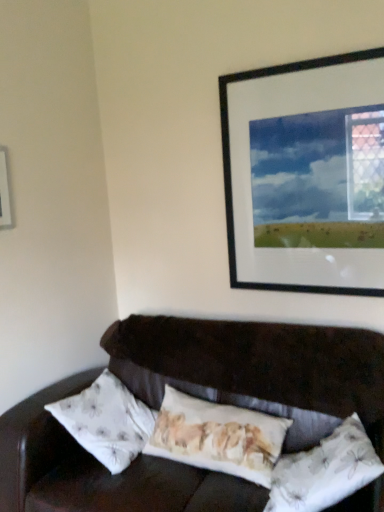
Locate an element on the screen. This screenshot has width=384, height=512. white plastic picture frame at upper left, the 1th picture frame from the left is located at coordinates (4, 192).

How much space does white floral fabric pillow at lower right, the 2th pillow when ordered from left to right, occupy horizontally?

white floral fabric pillow at lower right, the 2th pillow when ordered from left to right, is 18.55 inches in width.

Locate an element on the screen. This screenshot has width=384, height=512. black matte picture frame at upper right, which ranks as the second picture frame in left-to-right order is located at coordinates (306, 175).

Describe the element at coordinates (217, 437) in the screenshot. I see `floral fabric pillow at center, which is counted as the 1th pillow, starting from the left` at that location.

Locate an element on the screen. The width and height of the screenshot is (384, 512). white plastic picture frame at upper left, the 1th picture frame from the left is located at coordinates (4, 192).

Is white floral fabric pillow at lower right, which is the 1th pillow in right-to-left order, taller than white plastic picture frame at upper left, the 1th picture frame from the left?

Yes, white floral fabric pillow at lower right, which is the 1th pillow in right-to-left order, is taller than white plastic picture frame at upper left, the 1th picture frame from the left.

Would you say white floral fabric pillow at lower right, which is the 1th pillow in right-to-left order, is outside white plastic picture frame at upper left, the 1th picture frame from the left?

Absolutely, white floral fabric pillow at lower right, which is the 1th pillow in right-to-left order, is external to white plastic picture frame at upper left, the 1th picture frame from the left.

Between white floral fabric pillow at lower right, the 2th pillow when ordered from left to right, and white plastic picture frame at upper left, placed as the second picture frame when sorted from right to left, which one appears on the left side from the viewer's perspective?

white plastic picture frame at upper left, placed as the second picture frame when sorted from right to left.

From a real-world perspective, which is physically below, white floral fabric pillow at lower right, the 2th pillow when ordered from left to right, or white plastic picture frame at upper left, placed as the second picture frame when sorted from right to left?

In real-world perspective, white floral fabric pillow at lower right, the 2th pillow when ordered from left to right, is lower.

Which of these two, white floral fabric pillow at lower right, the 2th pillow when ordered from left to right, or floral fabric pillow at center, which is counted as the 1th pillow, starting from the left, stands shorter?

With less height is white floral fabric pillow at lower right, the 2th pillow when ordered from left to right.

At what (x,y) coordinates should I click in order to perform the action: click on pillow behind the white floral fabric pillow at lower right, the 2th pillow when ordered from left to right. Please return your answer as a coordinate pair (x, y). This screenshot has width=384, height=512. Looking at the image, I should click on (217, 437).

From the image's perspective, relative to floral fabric pillow at center, which is counted as the 1th pillow, starting from the left, is white floral fabric pillow at lower right, which is the 1th pillow in right-to-left order, above or below?

white floral fabric pillow at lower right, which is the 1th pillow in right-to-left order, is below floral fabric pillow at center, which is counted as the 1th pillow, starting from the left.

Considering the relative sizes of white floral fabric pillow at lower right, which is the 1th pillow in right-to-left order, and floral fabric pillow at center, which is counted as the 1th pillow, starting from the left, in the image provided, is white floral fabric pillow at lower right, which is the 1th pillow in right-to-left order, thinner than floral fabric pillow at center, which is counted as the 1th pillow, starting from the left,?

No, white floral fabric pillow at lower right, which is the 1th pillow in right-to-left order, is not thinner than floral fabric pillow at center, which is counted as the 1th pillow, starting from the left.

Is white floral fabric pillow at lower right, which is the 1th pillow in right-to-left order, at the right side of black matte picture frame at upper right, which ranks as the second picture frame in left-to-right order?

Incorrect, white floral fabric pillow at lower right, which is the 1th pillow in right-to-left order, is not on the right side of black matte picture frame at upper right, which ranks as the second picture frame in left-to-right order.

From the picture: What's the angular difference between white floral fabric pillow at lower right, which is the 1th pillow in right-to-left order, and black matte picture frame at upper right, marked as the first picture frame in a right-to-left arrangement,'s facing directions?

78.6 degrees separate the facing orientations of white floral fabric pillow at lower right, which is the 1th pillow in right-to-left order, and black matte picture frame at upper right, marked as the first picture frame in a right-to-left arrangement.

Does white floral fabric pillow at lower right, the 2th pillow when ordered from left to right, turn towards black matte picture frame at upper right, marked as the first picture frame in a right-to-left arrangement?

No, white floral fabric pillow at lower right, the 2th pillow when ordered from left to right, is not aimed at black matte picture frame at upper right, marked as the first picture frame in a right-to-left arrangement.

Starting from the white floral fabric pillow at lower right, the 2th pillow when ordered from left to right, which picture frame is the 2nd one behind? Please provide its 2D coordinates.

[(306, 175)]

From a real-world perspective, is floral fabric pillow at center, which is counted as the 1th pillow, starting from the left, positioned over white plastic picture frame at upper left, the 1th picture frame from the left, based on gravity?

Incorrect, from a real-world perspective, floral fabric pillow at center, which is counted as the 1th pillow, starting from the left, is lower than white plastic picture frame at upper left, the 1th picture frame from the left.

Considering the positions of points (187, 397) and (6, 155), is point (187, 397) closer to camera compared to point (6, 155)?

No, (187, 397) is further to viewer.

This screenshot has height=512, width=384. What are the coordinates of `picture frame on the left of floral fabric pillow at center, positioned as the 2th pillow in right-to-left order` in the screenshot? It's located at (4, 192).

From the image's perspective, which object appears higher, floral fabric pillow at center, positioned as the 2th pillow in right-to-left order, or white plastic picture frame at upper left, the 1th picture frame from the left?

From the image's view, white plastic picture frame at upper left, the 1th picture frame from the left, is above.

In the scene shown: Which is farther from the camera, (314, 113) or (348, 480)?

The point (314, 113) is farther.

Looking at this image, how different are the orientations of black matte picture frame at upper right, which ranks as the second picture frame in left-to-right order, and white floral fabric pillow at lower right, which is the 1th pillow in right-to-left order, in degrees?

They differ by 78.6 degrees in their facing directions.

Choose the correct answer: Is black matte picture frame at upper right, which ranks as the second picture frame in left-to-right order, inside white floral fabric pillow at lower right, the 2th pillow when ordered from left to right, or outside it?

black matte picture frame at upper right, which ranks as the second picture frame in left-to-right order, is outside white floral fabric pillow at lower right, the 2th pillow when ordered from left to right.

Is black matte picture frame at upper right, marked as the first picture frame in a right-to-left arrangement, wider or thinner than white floral fabric pillow at lower right, the 2th pillow when ordered from left to right?

black matte picture frame at upper right, marked as the first picture frame in a right-to-left arrangement, is thinner than white floral fabric pillow at lower right, the 2th pillow when ordered from left to right.

Is white plastic picture frame at upper left, the 1th picture frame from the left, turned away from white floral fabric pillow at lower right, the 2th pillow when ordered from left to right?

white plastic picture frame at upper left, the 1th picture frame from the left, does not have its back to white floral fabric pillow at lower right, the 2th pillow when ordered from left to right.

Between white plastic picture frame at upper left, placed as the second picture frame when sorted from right to left, and white floral fabric pillow at lower right, which is the 1th pillow in right-to-left order, which one has less height?

Standing shorter between the two is white plastic picture frame at upper left, placed as the second picture frame when sorted from right to left.

Starting from the white plastic picture frame at upper left, the 1th picture frame from the left, which pillow is the 2nd one to the right? Please provide its 2D coordinates.

[(325, 471)]

Considering the relative sizes of white plastic picture frame at upper left, the 1th picture frame from the left, and floral fabric pillow at center, which is counted as the 1th pillow, starting from the left, in the image provided, is white plastic picture frame at upper left, the 1th picture frame from the left, shorter than floral fabric pillow at center, which is counted as the 1th pillow, starting from the left,?

Yes, white plastic picture frame at upper left, the 1th picture frame from the left, is shorter than floral fabric pillow at center, which is counted as the 1th pillow, starting from the left.

Could you tell me if white plastic picture frame at upper left, placed as the second picture frame when sorted from right to left, is turned towards floral fabric pillow at center, positioned as the 2th pillow in right-to-left order?

No, white plastic picture frame at upper left, placed as the second picture frame when sorted from right to left, is not facing towards floral fabric pillow at center, positioned as the 2th pillow in right-to-left order.

Is white plastic picture frame at upper left, the 1th picture frame from the left, in front of or behind floral fabric pillow at center, positioned as the 2th pillow in right-to-left order, in the image?

white plastic picture frame at upper left, the 1th picture frame from the left, is positioned farther from the viewer than floral fabric pillow at center, positioned as the 2th pillow in right-to-left order.

Which is in front, point (7, 190) or point (246, 428)?

The point (246, 428) is closer to the camera.

Locate an element on the screen. pillow that is the 2nd object directly below the white plastic picture frame at upper left, placed as the second picture frame when sorted from right to left (from a real-world perspective) is located at coordinates (325, 471).

The height and width of the screenshot is (512, 384). Identify the location of pillow in front of the floral fabric pillow at center, positioned as the 2th pillow in right-to-left order. (325, 471).

Based on their spatial positions, is floral fabric pillow at center, positioned as the 2th pillow in right-to-left order, or black matte picture frame at upper right, which ranks as the second picture frame in left-to-right order, closer to white floral fabric pillow at lower right, which is the 1th pillow in right-to-left order?

Based on the image, floral fabric pillow at center, positioned as the 2th pillow in right-to-left order, appears to be nearer to white floral fabric pillow at lower right, which is the 1th pillow in right-to-left order.

Looking at the image, which one is located further to white floral fabric pillow at lower right, the 2th pillow when ordered from left to right, black matte picture frame at upper right, which ranks as the second picture frame in left-to-right order, or white plastic picture frame at upper left, the 1th picture frame from the left?

Based on the image, white plastic picture frame at upper left, the 1th picture frame from the left, appears to be further to white floral fabric pillow at lower right, the 2th pillow when ordered from left to right.

From the image, which object appears to be nearer to white plastic picture frame at upper left, the 1th picture frame from the left, black matte picture frame at upper right, marked as the first picture frame in a right-to-left arrangement, or floral fabric pillow at center, positioned as the 2th pillow in right-to-left order?

Among the two, floral fabric pillow at center, positioned as the 2th pillow in right-to-left order, is located nearer to white plastic picture frame at upper left, the 1th picture frame from the left.

Which object lies further to the anchor point black matte picture frame at upper right, which ranks as the second picture frame in left-to-right order, floral fabric pillow at center, which is counted as the 1th pillow, starting from the left, or white plastic picture frame at upper left, the 1th picture frame from the left?

Based on the image, white plastic picture frame at upper left, the 1th picture frame from the left, appears to be further to black matte picture frame at upper right, which ranks as the second picture frame in left-to-right order.

When comparing their distances from white plastic picture frame at upper left, placed as the second picture frame when sorted from right to left, does white floral fabric pillow at lower right, which is the 1th pillow in right-to-left order, or black matte picture frame at upper right, marked as the first picture frame in a right-to-left arrangement, seem closer?

black matte picture frame at upper right, marked as the first picture frame in a right-to-left arrangement, is closer to white plastic picture frame at upper left, placed as the second picture frame when sorted from right to left.

Considering their positions, is white floral fabric pillow at lower right, which is the 1th pillow in right-to-left order, positioned further to white plastic picture frame at upper left, placed as the second picture frame when sorted from right to left, than floral fabric pillow at center, which is counted as the 1th pillow, starting from the left?

white floral fabric pillow at lower right, which is the 1th pillow in right-to-left order, lies further to white plastic picture frame at upper left, placed as the second picture frame when sorted from right to left, than the other object.

In the scene shown: Based on their spatial positions, is black matte picture frame at upper right, which ranks as the second picture frame in left-to-right order, or white floral fabric pillow at lower right, the 2th pillow when ordered from left to right, further from white plastic picture frame at upper left, placed as the second picture frame when sorted from right to left?

white floral fabric pillow at lower right, the 2th pillow when ordered from left to right, is further to white plastic picture frame at upper left, placed as the second picture frame when sorted from right to left.

Looking at the image, which one is located further to black matte picture frame at upper right, which ranks as the second picture frame in left-to-right order, white plastic picture frame at upper left, placed as the second picture frame when sorted from right to left, or white floral fabric pillow at lower right, which is the 1th pillow in right-to-left order?

Among the two, white plastic picture frame at upper left, placed as the second picture frame when sorted from right to left, is located further to black matte picture frame at upper right, which ranks as the second picture frame in left-to-right order.

You are a GUI agent. You are given a task and a screenshot of the screen. Output one action in this format:
    pyautogui.click(x=<x>, y=<y>)
    Task: Click on the pillow between white plastic picture frame at upper left, the 1th picture frame from the left, and white floral fabric pillow at lower right, which is the 1th pillow in right-to-left order, in the horizontal direction
    The image size is (384, 512).
    Given the screenshot: What is the action you would take?
    pyautogui.click(x=217, y=437)

Find the location of a particular element. This screenshot has width=384, height=512. pillow between black matte picture frame at upper right, which ranks as the second picture frame in left-to-right order, and white floral fabric pillow at lower right, the 2th pillow when ordered from left to right, in the up-down direction is located at coordinates (217, 437).